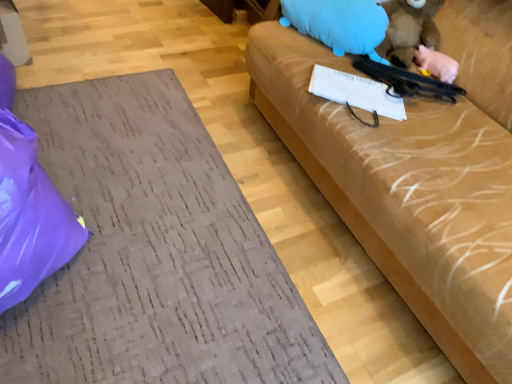
This screenshot has height=384, width=512. Describe the element at coordinates (409, 30) in the screenshot. I see `fuzzy brown animal at upper right, the second animal positioned from the right` at that location.

Locate an element on the screen. The width and height of the screenshot is (512, 384). blue plush toy at upper right, the first animal viewed from the left is located at coordinates (339, 24).

The image size is (512, 384). Describe the element at coordinates (154, 253) in the screenshot. I see `matte brown couch at right` at that location.

Locate an element on the screen. This screenshot has height=384, width=512. fuzzy brown animal at upper right, positioned as the 2th animal in left-to-right order is located at coordinates (409, 30).

Find the location of a particular element. This screenshot has height=384, width=512. furniture that is under the purple plastic bag at lower left (from a real-world perspective) is located at coordinates (154, 253).

Considering the positions of point (105, 280) and point (30, 244), is point (105, 280) closer or farther from the camera than point (30, 244)?

Point (105, 280) is positioned farther from the camera compared to point (30, 244).

How many degrees apart are the facing directions of matte brown couch at right and purple plastic bag at lower left?

There is a 89.9-degree angle between the facing directions of matte brown couch at right and purple plastic bag at lower left.

Is matte brown couch at right situated inside purple plastic bag at lower left or outside?

matte brown couch at right is outside purple plastic bag at lower left.

Is brown fabric couch at right in front of or behind purple plastic bag at lower left in the image?

Visually, brown fabric couch at right is located in front of purple plastic bag at lower left.

Is brown fabric couch at right not close to purple plastic bag at lower left?

Yes, brown fabric couch at right and purple plastic bag at lower left are quite far apart.

Looking at this image, is brown fabric couch at right inside or outside of purple plastic bag at lower left?

brown fabric couch at right cannot be found inside purple plastic bag at lower left.

From the image's perspective, does brown fabric couch at right appear lower than purple plastic bag at lower left?

No, from the image's perspective, brown fabric couch at right is not beneath purple plastic bag at lower left.

Are pink rubber pig at upper right, which appears as the 1th animal when viewed from the right, and brown fabric couch at right beside each other?

No, pink rubber pig at upper right, which appears as the 1th animal when viewed from the right, is not in contact with brown fabric couch at right.

In terms of height, does pink rubber pig at upper right, which appears as the 1th animal when viewed from the right, look taller or shorter compared to brown fabric couch at right?

Clearly, pink rubber pig at upper right, which appears as the 1th animal when viewed from the right, is shorter compared to brown fabric couch at right.

Which is in front, point (453, 74) or point (473, 184)?

Point (473, 184)

Is brown fabric couch at right at the back of pink rubber pig at upper right, arranged as the 3th animal when viewed from the left?

Yes, brown fabric couch at right is at the back of pink rubber pig at upper right, arranged as the 3th animal when viewed from the left.

From a real-world perspective, between matte brown couch at right and brown fabric couch at right, who is vertically lower?

matte brown couch at right, from a real-world perspective.

Considering the positions of objects matte brown couch at right and brown fabric couch at right in the image provided, who is more to the left, matte brown couch at right or brown fabric couch at right?

matte brown couch at right is more to the left.

Does point (163, 292) lie in front of point (489, 229)?

No, (163, 292) is behind (489, 229).

Can you tell me how much matte brown couch at right and brown fabric couch at right differ in facing direction?

90.5 degrees separate the facing orientations of matte brown couch at right and brown fabric couch at right.

Is purple plastic bag at lower left inside the boundaries of fuzzy brown animal at upper right, positioned as the 2th animal in left-to-right order, or outside?

purple plastic bag at lower left is not inside fuzzy brown animal at upper right, positioned as the 2th animal in left-to-right order, it's outside.

Based on their positions, is purple plastic bag at lower left located to the left or right of fuzzy brown animal at upper right, the second animal positioned from the right?

purple plastic bag at lower left is positioned on fuzzy brown animal at upper right, the second animal positioned from the right,'s left side.

Is purple plastic bag at lower left far from fuzzy brown animal at upper right, positioned as the 2th animal in left-to-right order?

Indeed, purple plastic bag at lower left is not near fuzzy brown animal at upper right, positioned as the 2th animal in left-to-right order.

Considering the sizes of objects brown fabric couch at right and matte brown couch at right in the image provided, who is bigger, brown fabric couch at right or matte brown couch at right?

With larger size is brown fabric couch at right.

Is brown fabric couch at right in front of or behind matte brown couch at right in the image?

Clearly, brown fabric couch at right is in front of matte brown couch at right.

Is brown fabric couch at right located outside matte brown couch at right?

That's correct, brown fabric couch at right is outside of matte brown couch at right.

From the image's perspective, is brown fabric couch at right located beneath matte brown couch at right?

Incorrect, from the image's perspective, brown fabric couch at right is higher than matte brown couch at right.

Is pink rubber pig at upper right, arranged as the 3th animal when viewed from the left, facing away from fuzzy brown animal at upper right, the second animal positioned from the right?

No.

From the picture: Are pink rubber pig at upper right, which appears as the 1th animal when viewed from the right, and fuzzy brown animal at upper right, the second animal positioned from the right, located far from each other?

Actually, pink rubber pig at upper right, which appears as the 1th animal when viewed from the right, and fuzzy brown animal at upper right, the second animal positioned from the right, are a little close together.

From the image's perspective, is pink rubber pig at upper right, arranged as the 3th animal when viewed from the left, below fuzzy brown animal at upper right, the second animal positioned from the right?

Yes.

Which of these two, pink rubber pig at upper right, which appears as the 1th animal when viewed from the right, or fuzzy brown animal at upper right, the second animal positioned from the right, stands shorter?

Standing shorter between the two is pink rubber pig at upper right, which appears as the 1th animal when viewed from the right.

Find the location of `bag above the matte brown couch at right (from a real-world perspective)`. bag above the matte brown couch at right (from a real-world perspective) is located at coordinates (30, 216).

Identify the location of studio couch in front of the purple plastic bag at lower left. This screenshot has height=384, width=512. (407, 196).

When comparing their distances from blue plush toy at upper right, placed as the third animal when sorted from right to left, does fuzzy brown animal at upper right, the second animal positioned from the right, or purple plastic bag at lower left seem further?

The object further to blue plush toy at upper right, placed as the third animal when sorted from right to left, is purple plastic bag at lower left.

Looking at the image, which one is located closer to pink rubber pig at upper right, arranged as the 3th animal when viewed from the left, matte brown couch at right or purple plastic bag at lower left?

Based on the image, matte brown couch at right appears to be nearer to pink rubber pig at upper right, arranged as the 3th animal when viewed from the left.

When comparing their distances from fuzzy brown animal at upper right, the second animal positioned from the right, does matte brown couch at right or pink rubber pig at upper right, which appears as the 1th animal when viewed from the right, seem closer?

pink rubber pig at upper right, which appears as the 1th animal when viewed from the right.

Considering their positions, is matte brown couch at right positioned closer to fuzzy brown animal at upper right, the second animal positioned from the right, than purple plastic bag at lower left?

matte brown couch at right is closer to fuzzy brown animal at upper right, the second animal positioned from the right.

Looking at the image, which one is located closer to blue plush toy at upper right, the first animal viewed from the left, brown fabric couch at right or matte brown couch at right?

brown fabric couch at right.

When comparing their distances from pink rubber pig at upper right, which appears as the 1th animal when viewed from the right, does fuzzy brown animal at upper right, positioned as the 2th animal in left-to-right order, or purple plastic bag at lower left seem further?

purple plastic bag at lower left lies further to pink rubber pig at upper right, which appears as the 1th animal when viewed from the right, than the other object.

Considering their positions, is blue plush toy at upper right, placed as the third animal when sorted from right to left, positioned closer to purple plastic bag at lower left than brown fabric couch at right?

Among the two, brown fabric couch at right is located nearer to purple plastic bag at lower left.

From the image, which object appears to be nearer to purple plastic bag at lower left, matte brown couch at right or blue plush toy at upper right, placed as the third animal when sorted from right to left?

The object closer to purple plastic bag at lower left is matte brown couch at right.

Where is `furniture situated between purple plastic bag at lower left and brown fabric couch at right from left to right`? The width and height of the screenshot is (512, 384). furniture situated between purple plastic bag at lower left and brown fabric couch at right from left to right is located at coordinates (154, 253).

Locate an element on the screen. The image size is (512, 384). animal between purple plastic bag at lower left and fuzzy brown animal at upper right, the second animal positioned from the right, from left to right is located at coordinates pos(339,24).

At what (x,y) coordinates should I click in order to perform the action: click on furniture located between purple plastic bag at lower left and pink rubber pig at upper right, arranged as the 3th animal when viewed from the left, in the left-right direction. Please return your answer as a coordinate pair (x, y). Looking at the image, I should click on (154, 253).

Where is `animal located between blue plush toy at upper right, placed as the third animal when sorted from right to left, and pink rubber pig at upper right, arranged as the 3th animal when viewed from the left, in the left-right direction`? The width and height of the screenshot is (512, 384). animal located between blue plush toy at upper right, placed as the third animal when sorted from right to left, and pink rubber pig at upper right, arranged as the 3th animal when viewed from the left, in the left-right direction is located at coordinates (409, 30).